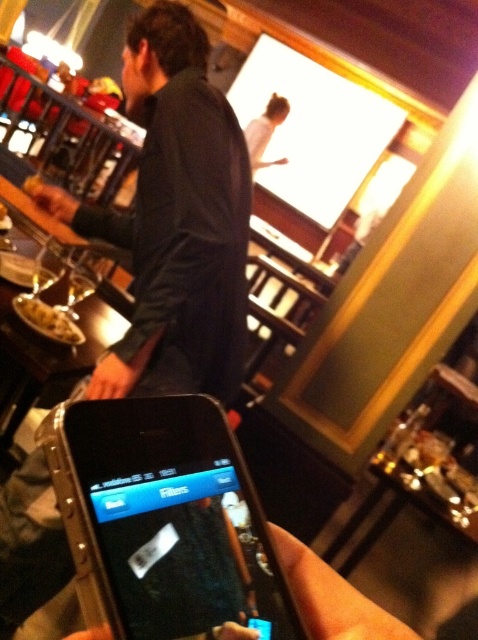
Can you confirm if matte brown bread at lower left is wider than matte black hand at center?

Incorrect, matte brown bread at lower left's width does not surpass matte black hand at center's.

Can you confirm if matte brown bread at lower left is positioned below matte black hand at center?

Yes, matte brown bread at lower left is below matte black hand at center.

In order to click on matte brown bread at lower left in this screenshot , I will do `click(46, 321)`.

Is black plastic smartphone at lower center in front of matte black hand at center?

Yes.

Measure the distance from black plastic smartphone at lower center to matte black hand at center.

4.57 feet

Locate an element on the screen. The width and height of the screenshot is (478, 640). black plastic smartphone at lower center is located at coordinates (169, 520).

You are a GUI agent. You are given a task and a screenshot of the screen. Output one action in this format:
    pyautogui.click(x=<x>, y=<y>)
    Task: Click on the black plastic smartphone at lower center
    This screenshot has height=640, width=478.
    Given the screenshot: What is the action you would take?
    pyautogui.click(x=169, y=520)

Between black plastic smartphone at lower center and matte brown bread at lower left, which one is positioned higher?

matte brown bread at lower left

Can you confirm if black plastic smartphone at lower center is positioned below matte brown bread at lower left?

Yes.

In order to click on black plastic smartphone at lower center in this screenshot , I will do `click(169, 520)`.

Locate an element on the screen. The height and width of the screenshot is (640, 478). black plastic smartphone at lower center is located at coordinates (169, 520).